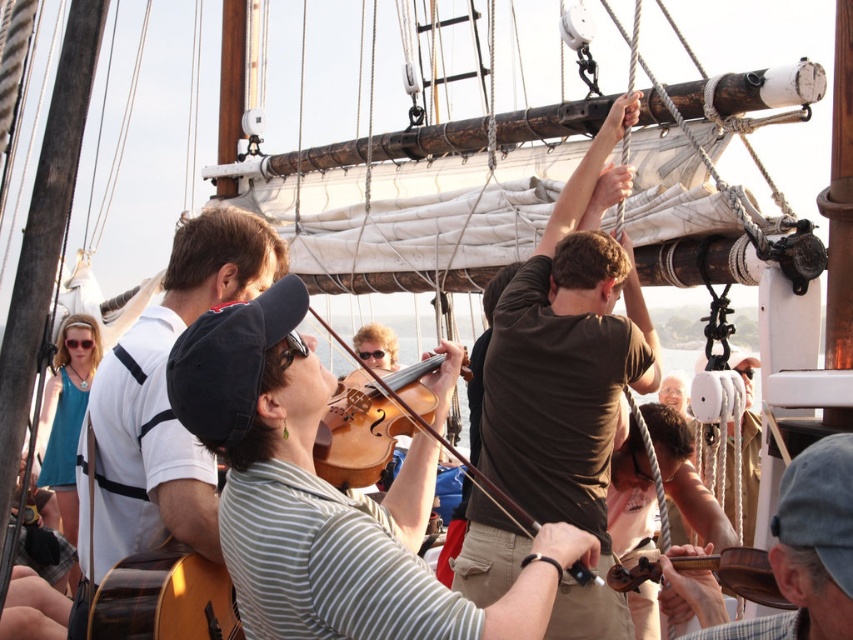
Locate an element on the screen. Image resolution: width=853 pixels, height=640 pixels. brown cotton shirt at upper center is located at coordinates (566, 356).

How much distance is there between brown cotton shirt at upper center and wooden violin at center?

brown cotton shirt at upper center and wooden violin at center are 4.26 meters apart.

Can you confirm if brown cotton shirt at upper center is positioned above wooden violin at center?

Correct, brown cotton shirt at upper center is located above wooden violin at center.

Is point (560, 276) positioned after point (467, 465)?

That is True.

Identify the location of brown cotton shirt at upper center. (566, 356).

Is brown cotton shirt at upper center shorter than brown wooden violin at upper center?

No.

Does brown cotton shirt at upper center have a greater height compared to brown wooden violin at upper center?

Yes.

Is point (473, 602) farther from viewer compared to point (836, 476)?

That is True.

Identify the location of brown cotton shirt at upper center. Image resolution: width=853 pixels, height=640 pixels. (566, 356).